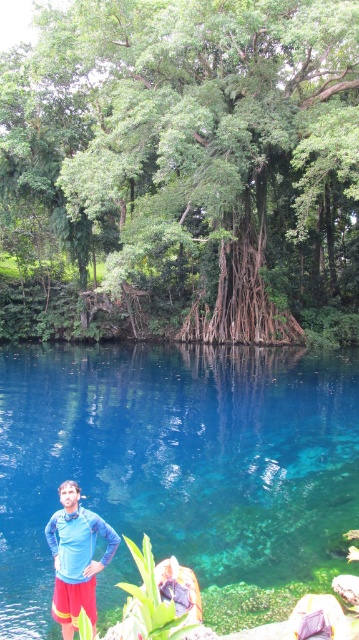
You are standing at the camera position and want to take a photo of the green leafy tree at center. If your camera has a maximum focus range of 70 feet, will you be able to focus on the tree?

The green leafy tree at center and camera are 68.78 feet apart. Since the distance is within the camera maximum focus range of 70 feet, the camera can focus on the green leafy tree at center.